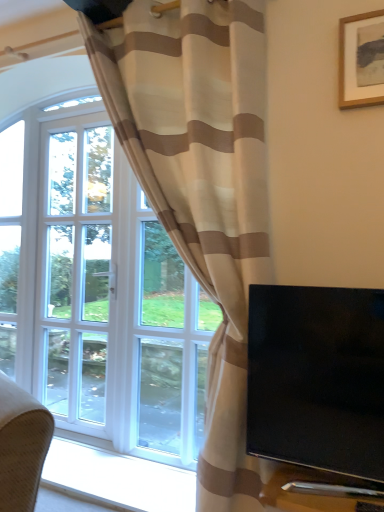
Describe the element at coordinates (201, 187) in the screenshot. I see `beige striped curtain at left` at that location.

Locate an element on the screen. This screenshot has width=384, height=512. black glossy tv at right is located at coordinates (317, 378).

This screenshot has width=384, height=512. What do you see at coordinates (317, 378) in the screenshot?
I see `black glossy tv at right` at bounding box center [317, 378].

The height and width of the screenshot is (512, 384). In order to click on wooden picture frame at upper right in this screenshot , I will do `click(361, 60)`.

Considering the sizes of objects wooden picture frame at upper right and beige striped curtain at left in the image provided, who is taller, wooden picture frame at upper right or beige striped curtain at left?

Standing taller between the two is beige striped curtain at left.

Is wooden picture frame at upper right facing away from beige striped curtain at left?

wooden picture frame at upper right does not have its back to beige striped curtain at left.

In the scene shown: Is wooden picture frame at upper right bigger than beige striped curtain at left?

Actually, wooden picture frame at upper right might be smaller than beige striped curtain at left.

Does wooden picture frame at upper right have a lesser width compared to beige striped curtain at left?

Yes, wooden picture frame at upper right is thinner than beige striped curtain at left.

Who is shorter, wooden picture frame at upper right or black glossy tv at right?

wooden picture frame at upper right.

From the image's perspective, which object appears higher, wooden picture frame at upper right or black glossy tv at right?

From the image's view, wooden picture frame at upper right is above.

Does wooden picture frame at upper right contain black glossy tv at right?

Definitely not — black glossy tv at right is not inside wooden picture frame at upper right.

How many degrees apart are the facing directions of wooden picture frame at upper right and black glossy tv at right?

1.21 degrees.

From a real-world perspective, is black glossy tv at right physically located above or below white glass screen door at left?

Clearly, from a real-world perspective, black glossy tv at right is below white glass screen door at left.

Does black glossy tv at right have a greater width compared to white glass screen door at left?

No, black glossy tv at right is not wider than white glass screen door at left.

Is black glossy tv at right aimed at white glass screen door at left?

No, black glossy tv at right is not facing towards white glass screen door at left.

Which object is more forward, black glossy tv at right or white glass screen door at left?

black glossy tv at right is more forward.

Which of these two, wooden picture frame at upper right or white glass screen door at left, is bigger?

white glass screen door at left.

Considering the relative positions of wooden picture frame at upper right and white glass screen door at left in the image provided, is wooden picture frame at upper right to the right of white glass screen door at left from the viewer's perspective?

Correct, you'll find wooden picture frame at upper right to the right of white glass screen door at left.

Which of these two, wooden picture frame at upper right or white glass screen door at left, stands shorter?

With less height is wooden picture frame at upper right.

Is black glossy tv at right positioned in front of beige striped curtain at left?

Yes, the depth of black glossy tv at right is less than that of beige striped curtain at left.

Based on the photo, does black glossy tv at right have a lesser height compared to beige striped curtain at left?

Correct, black glossy tv at right is not as tall as beige striped curtain at left.

Which is more to the right, black glossy tv at right or beige striped curtain at left?

Positioned to the right is black glossy tv at right.

Is beige striped curtain at left placed right next to black glossy tv at right?

There is a gap between beige striped curtain at left and black glossy tv at right.

From a real-world perspective, which object rests below the other?

From a 3D spatial view, black glossy tv at right is below.

Who is smaller, beige striped curtain at left or black glossy tv at right?

black glossy tv at right.

In terms of width, does beige striped curtain at left look wider or thinner when compared to black glossy tv at right?

Clearly, beige striped curtain at left has more width compared to black glossy tv at right.

From the image's perspective, which object appears higher, white glass screen door at left or wooden picture frame at upper right?

wooden picture frame at upper right appears higher in the image.

How far apart are white glass screen door at left and wooden picture frame at upper right?

white glass screen door at left is 1.72 meters away from wooden picture frame at upper right.

Looking at this image, from a real-world perspective, which is physically below, white glass screen door at left or wooden picture frame at upper right?

white glass screen door at left is physically lower.

Can you tell me how much white glass screen door at left and wooden picture frame at upper right differ in facing direction?

The facing directions of white glass screen door at left and wooden picture frame at upper right are 0.347 degrees apart.

Find the location of a particular element. The width and height of the screenshot is (384, 512). picture frame located above the beige striped curtain at left (from the image's perspective) is located at coordinates (361, 60).

What are the coordinates of `television below the wooden picture frame at upper right (from the image's perspective)` in the screenshot? It's located at (317, 378).

Considering their positions, is black glossy tv at right positioned further to white glass screen door at left than wooden picture frame at upper right?

wooden picture frame at upper right is positioned further to the anchor white glass screen door at left.

From the image, which object appears to be nearer to beige striped curtain at left, black glossy tv at right or white glass screen door at left?

The object closer to beige striped curtain at left is black glossy tv at right.

Estimate the real-world distances between objects in this image. Which object is closer to black glossy tv at right, wooden picture frame at upper right or beige striped curtain at left?

Based on the image, beige striped curtain at left appears to be nearer to black glossy tv at right.

When comparing their distances from wooden picture frame at upper right, does beige striped curtain at left or black glossy tv at right seem closer?

Among the two, beige striped curtain at left is located nearer to wooden picture frame at upper right.

Considering their positions, is wooden picture frame at upper right positioned further to beige striped curtain at left than black glossy tv at right?

Based on the image, wooden picture frame at upper right appears to be further to beige striped curtain at left.

Estimate the real-world distances between objects in this image. Which object is closer to wooden picture frame at upper right, white glass screen door at left or beige striped curtain at left?

beige striped curtain at left lies closer to wooden picture frame at upper right than the other object.

When comparing their distances from white glass screen door at left, does beige striped curtain at left or wooden picture frame at upper right seem closer?

beige striped curtain at left is closer to white glass screen door at left.

From the image, which object appears to be nearer to black glossy tv at right, white glass screen door at left or beige striped curtain at left?

Among the two, beige striped curtain at left is located nearer to black glossy tv at right.

The image size is (384, 512). Find the location of `curtain between wooden picture frame at upper right and black glossy tv at right from top to bottom`. curtain between wooden picture frame at upper right and black glossy tv at right from top to bottom is located at coordinates (201, 187).

Locate an element on the screen. This screenshot has height=512, width=384. curtain situated between white glass screen door at left and wooden picture frame at upper right from left to right is located at coordinates (201, 187).

Identify the location of curtain between black glossy tv at right and white glass screen door at left from front to back. (201, 187).

Identify the location of television located between white glass screen door at left and wooden picture frame at upper right in the left-right direction. The image size is (384, 512). (317, 378).